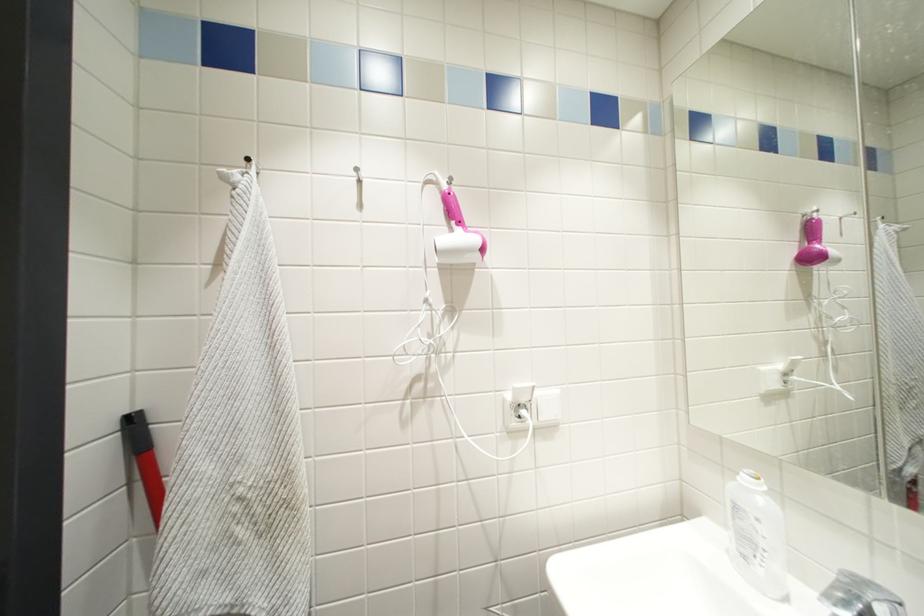
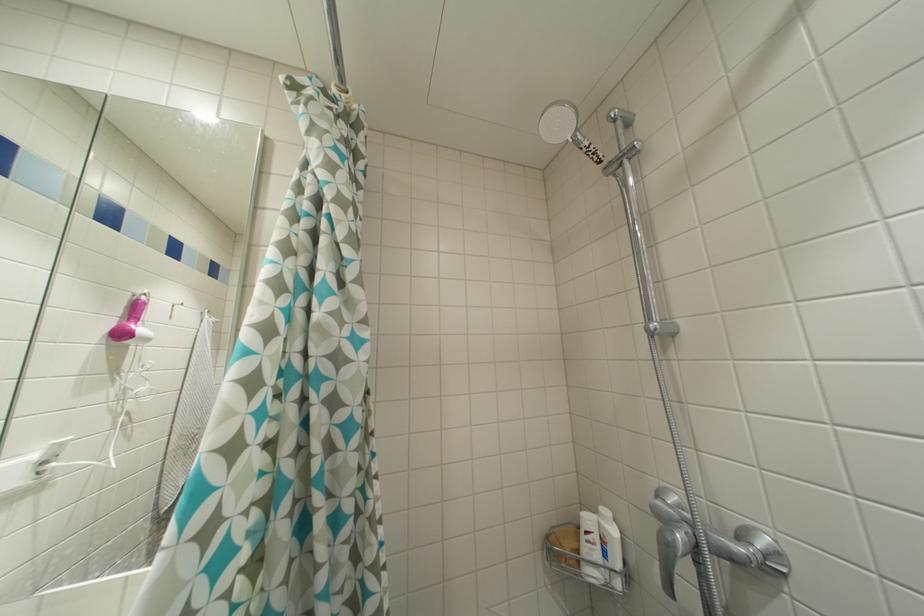
Question: The camera is either moving clockwise (left) or counter-clockwise (right) around the object. The first image is from the beginning of the video and the second image is from the end. Is the camera moving left or right when shooting the video?

Choices:
 (A) Left
 (B) Right

Answer: (A)